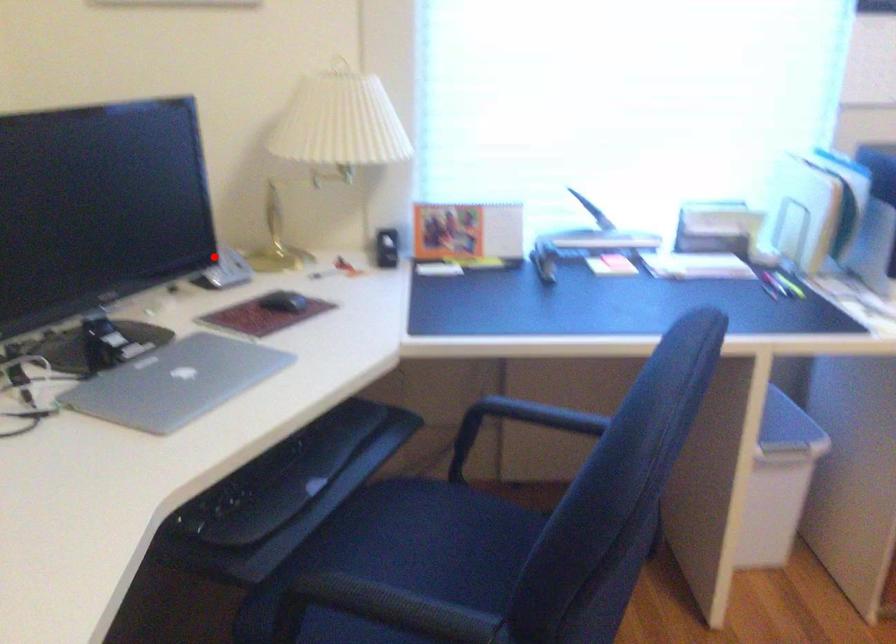
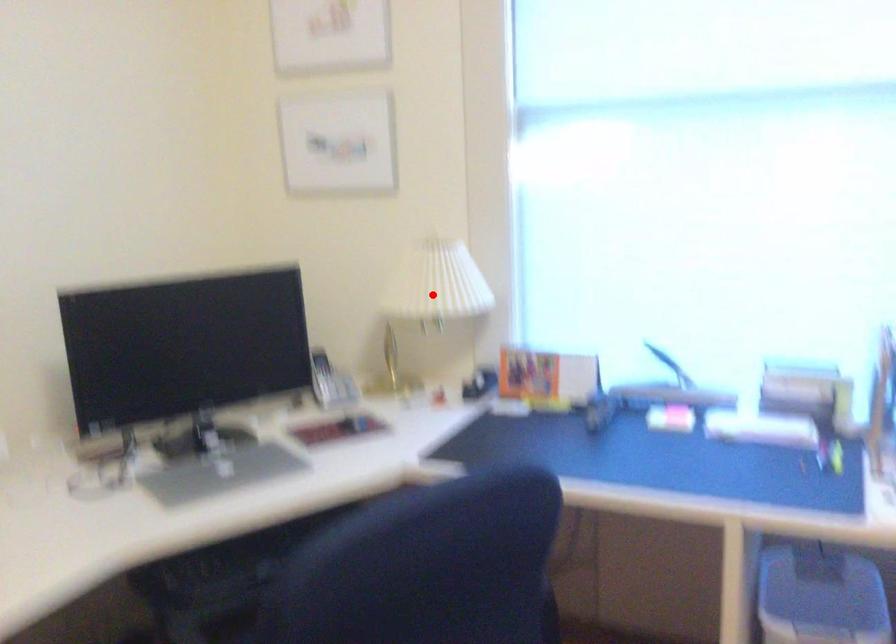
I am providing you with two images of the same scene from different viewpoints. A red point is marked on the first image and another point is marked on the second image. Do the highlighted points in image1 and image2 indicate the same real-world spot?

No